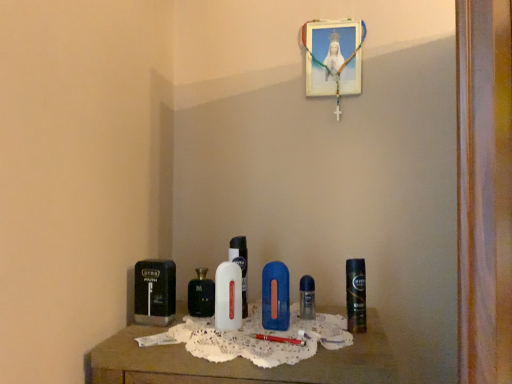
Where is `free space in front of white glossy bottle at center, the 4th perfume when ordered from back to front`? free space in front of white glossy bottle at center, the 4th perfume when ordered from back to front is located at coordinates (232, 343).